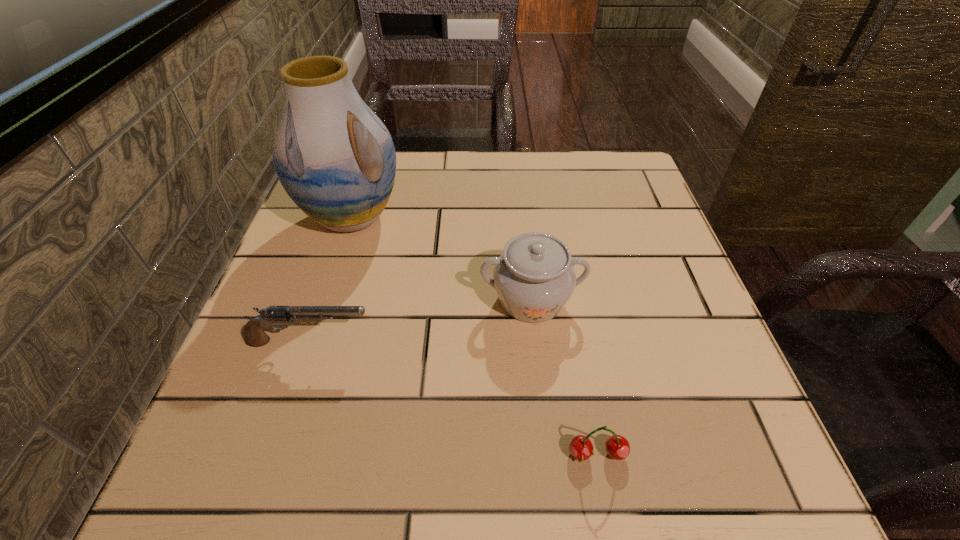
Select which object appears as the second closest to the farthest object. Please provide its 2D coordinates. Your answer should be formatted as a tuple, i.e. [(x, y)], where the tuple contains the x and y coordinates of a point satisfying the conditions above.

[(254, 335)]

Locate which object ranks in proximity to the second farthest object. Please provide its 2D coordinates. Your answer should be formatted as a tuple, i.e. [(x, y)], where the tuple contains the x and y coordinates of a point satisfying the conditions above.

[(334, 157)]

Locate an element on the screen. The height and width of the screenshot is (540, 960). free space that satisfies the following two spatial constraints: 1. on the front side of the chinaware; 2. aiming along the barrel of the gun is located at coordinates (536, 342).